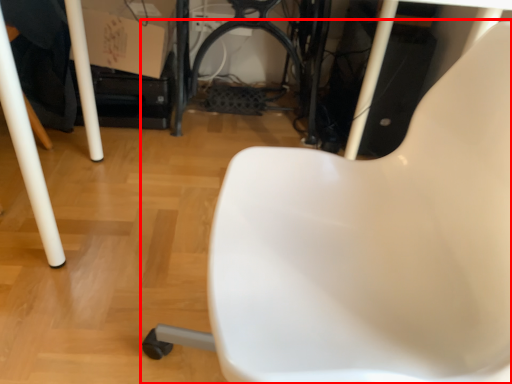
Question: From the image's perspective, what is the correct spatial positioning of chair (annotated by the red box) in reference to cardboard box?

Choices:
 (A) below
 (B) above

Answer: (A)